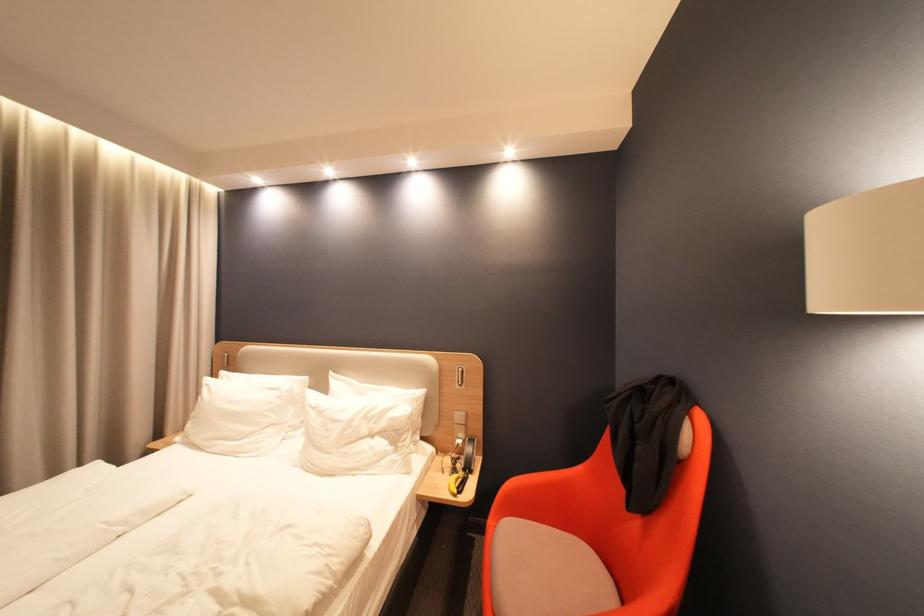
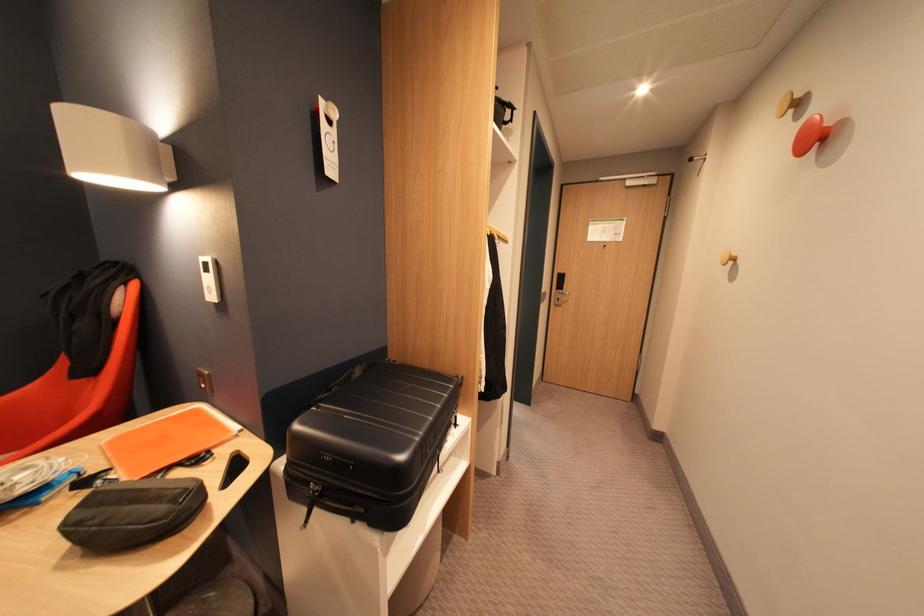
Question: The camera is either moving clockwise (left) or counter-clockwise (right) around the object. The first image is from the beginning of the video and the second image is from the end. Is the camera moving left or right when shooting the video?

Choices:
 (A) Left
 (B) Right

Answer: (A)